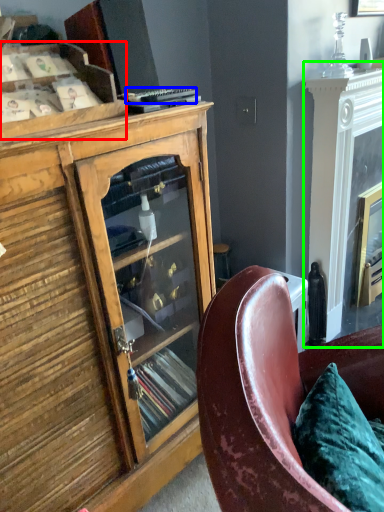
Question: Which is farther away from shelf (highlighted by a red box)? remote control (highlighted by a blue box) or fireplace (highlighted by a green box)?

Choices:
 (A) remote control
 (B) fireplace

Answer: (B)